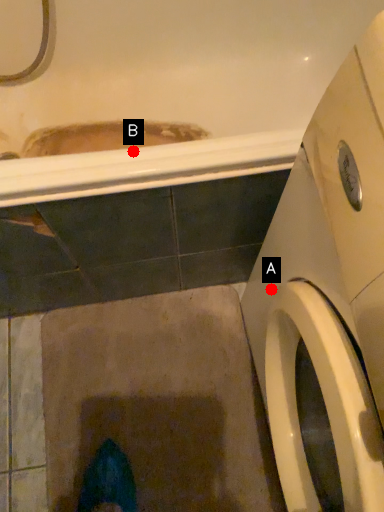
Question: Two points are circled on the image, labeled by A and B beside each circle. Which point is farther to the camera?

Choices:
 (A) A is further
 (B) B is further

Answer: (A)